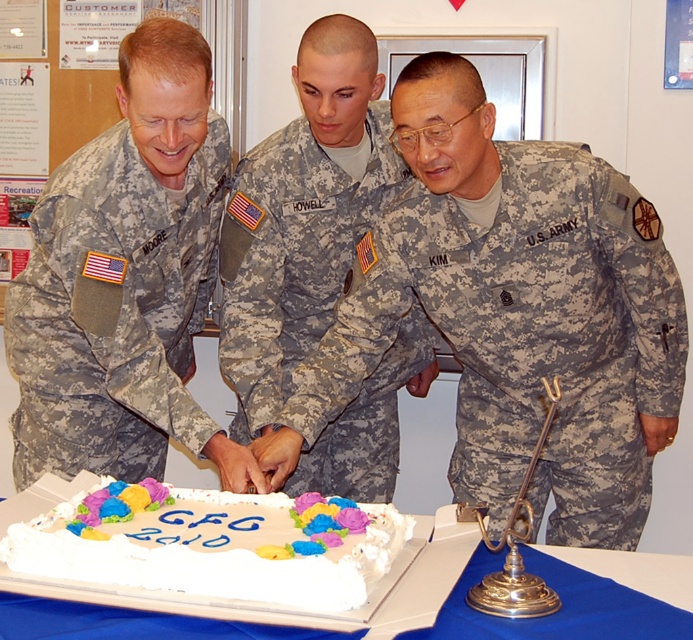
Question: Can you confirm if camouflage fabric uniform at center is positioned to the right of white cardboard cake at center?

Choices:
 (A) no
 (B) yes

Answer: (A)

Question: Is camouflage fabric uniform at left to the right of white cardboard cake at center from the viewer's perspective?

Choices:
 (A) no
 (B) yes

Answer: (A)

Question: Is the position of camouflage fabric us army uniform at center less distant than that of white cardboard cake at center?

Choices:
 (A) yes
 (B) no

Answer: (B)

Question: Which point appears farthest from the camera in this image?

Choices:
 (A) (574, 349)
 (B) (87, 625)
 (C) (367, 166)

Answer: (C)

Question: Which point is farther to the camera?

Choices:
 (A) camouflage fabric uniform at left
 (B) camouflage fabric uniform at center
 (C) white frosted rectangular cake at lower center
 (D) white cardboard cake at center

Answer: (B)

Question: Which point is farther from the camera taking this photo?

Choices:
 (A) (552, 584)
 (B) (157, 524)

Answer: (B)